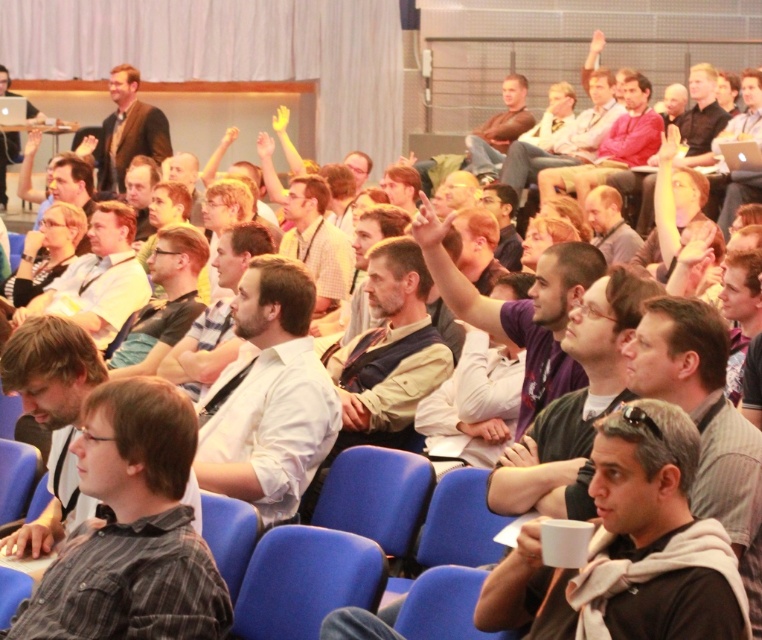
Is point (255, 285) closer to viewer compared to point (21, 300)?

Yes, point (255, 285) is in front of point (21, 300).

Can you confirm if white shirt at center is shorter than matte black glasses at center?

No, white shirt at center is not shorter than matte black glasses at center.

The image size is (762, 640). What are the coordinates of `white shirt at center` in the screenshot? It's located at (267, 396).

From the picture: Can you confirm if gray striped shirt at center is thinner than matte black glasses at center?

No, gray striped shirt at center is not thinner than matte black glasses at center.

Which of these two, gray striped shirt at center or matte black glasses at center, stands taller?

matte black glasses at center is taller.

Does point (139, 566) lie behind point (31, 259)?

No, (139, 566) is closer to viewer.

Identify the location of gray striped shirt at center. Image resolution: width=762 pixels, height=640 pixels. (130, 531).

The width and height of the screenshot is (762, 640). I want to click on gray striped shirt at center, so click(130, 531).

Between gray striped shirt at center and white shirt at center, which one is positioned higher?

white shirt at center

Between point (82, 545) and point (235, 436), which one is positioned in front?

Positioned in front is point (82, 545).

Find the location of a particular element. gray striped shirt at center is located at coordinates (130, 531).